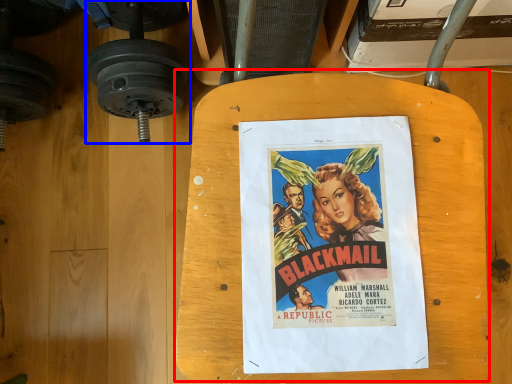
Question: Which point is closer to the camera, table (highlighted by a red box) or dumbbell (highlighted by a blue box)?

Choices:
 (A) table
 (B) dumbbell

Answer: (A)